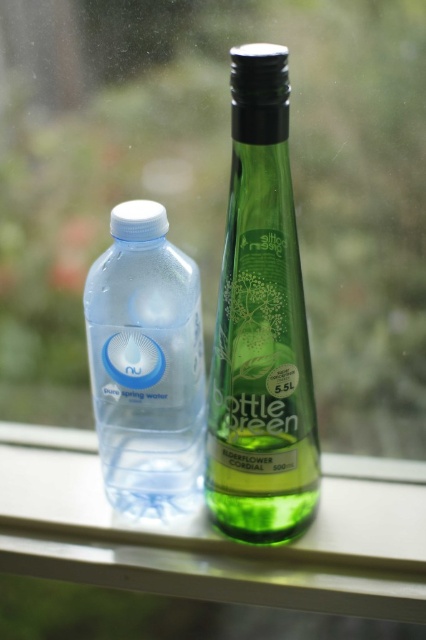
Does clear plastic bottle at center lie in front of transparent plastic bottle at left?

No.

This screenshot has width=426, height=640. What are the coordinates of `clear plastic bottle at center` in the screenshot? It's located at (215, 534).

Identify the location of clear plastic bottle at center. (215, 534).

Measure the distance from clear plastic bottle at center to green glass bottle at center.

clear plastic bottle at center and green glass bottle at center are 22.22 centimeters apart.

Which of these two, clear plastic bottle at center or green glass bottle at center, stands taller?

Standing taller between the two is green glass bottle at center.

Identify the location of clear plastic bottle at center. (215, 534).

Between point (233, 369) and point (195, 364), which one is positioned behind?

The point (195, 364) is more distant.

Who is more distant from viewer, (287,246) or (178,442)?

Point (178,442)

Where is `green glass bottle at center`? This screenshot has width=426, height=640. green glass bottle at center is located at coordinates (261, 324).